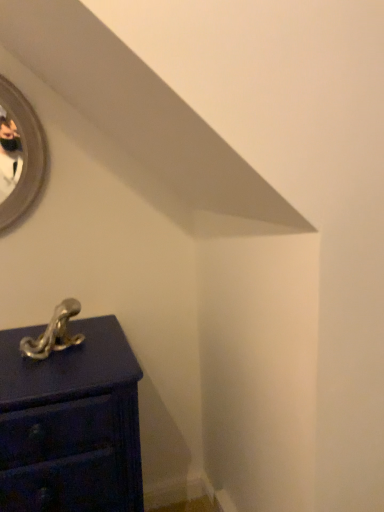
Question: Is the surface of polished silver hook at lower left in direct contact with matte dark blue chest of drawers at lower left?

Choices:
 (A) yes
 (B) no

Answer: (B)

Question: From the image's perspective, would you say polished silver hook at lower left is positioned over matte dark blue chest of drawers at lower left?

Choices:
 (A) no
 (B) yes

Answer: (B)

Question: From the image's perspective, is polished silver hook at lower left located beneath matte dark blue chest of drawers at lower left?

Choices:
 (A) no
 (B) yes

Answer: (A)

Question: Is the position of polished silver hook at lower left less distant than that of matte dark blue chest of drawers at lower left?

Choices:
 (A) yes
 (B) no

Answer: (B)

Question: Is polished silver hook at lower left thinner than matte dark blue chest of drawers at lower left?

Choices:
 (A) yes
 (B) no

Answer: (A)

Question: Considering the relative sizes of polished silver hook at lower left and matte dark blue chest of drawers at lower left in the image provided, is polished silver hook at lower left bigger than matte dark blue chest of drawers at lower left?

Choices:
 (A) yes
 (B) no

Answer: (B)

Question: Can you see matte dark blue chest of drawers at lower left touching polished silver hook at lower left?

Choices:
 (A) yes
 (B) no

Answer: (B)

Question: Does matte dark blue chest of drawers at lower left come in front of polished silver hook at lower left?

Choices:
 (A) yes
 (B) no

Answer: (A)

Question: From a real-world perspective, is matte dark blue chest of drawers at lower left located higher than polished silver hook at lower left?

Choices:
 (A) no
 (B) yes

Answer: (A)

Question: Can you confirm if matte dark blue chest of drawers at lower left is taller than polished silver hook at lower left?

Choices:
 (A) yes
 (B) no

Answer: (A)

Question: Is polished silver hook at lower left at the back of matte dark blue chest of drawers at lower left?

Choices:
 (A) yes
 (B) no

Answer: (B)

Question: Can you confirm if matte dark blue chest of drawers at lower left is thinner than polished silver hook at lower left?

Choices:
 (A) no
 (B) yes

Answer: (A)

Question: Considering the relative positions of matte dark blue chest of drawers at lower left and polished silver hook at lower left in the image provided, is matte dark blue chest of drawers at lower left to the left or to the right of polished silver hook at lower left?

Choices:
 (A) right
 (B) left

Answer: (A)